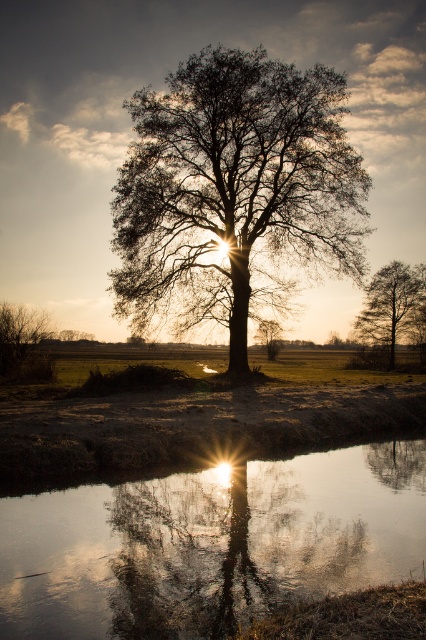
Question: Based on their relative distances, which object is nearer to the transparent reflective water at center?

Choices:
 (A) green matte bush at lower left
 (B) silhouette leafy tree at center

Answer: (A)

Question: Can you confirm if transparent reflective water at center is positioned above green matte bush at lower left?

Choices:
 (A) no
 (B) yes

Answer: (A)

Question: Which point is closer to the camera taking this photo?

Choices:
 (A) (221, 305)
 (B) (360, 321)

Answer: (A)

Question: Does silhouette leafy tree at center appear on the right side of green matte bush at lower left?

Choices:
 (A) no
 (B) yes

Answer: (B)

Question: Can you confirm if silhouette leafy tree at center is positioned below smooth bark tree at right?

Choices:
 (A) yes
 (B) no

Answer: (B)

Question: Which of these objects is positioned closest to the silhouette leafy tree at center?

Choices:
 (A) smooth bark tree at right
 (B) green matte bush at lower left
 (C) transparent reflective water at center

Answer: (B)